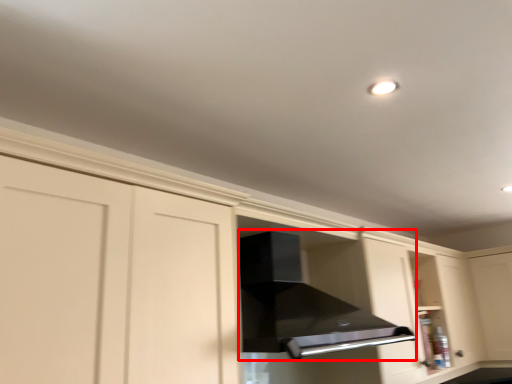
Question: From the image's perspective, what is the correct spatial positioning of vent (annotated by the red box) in reference to glass door?

Choices:
 (A) above
 (B) below

Answer: (A)